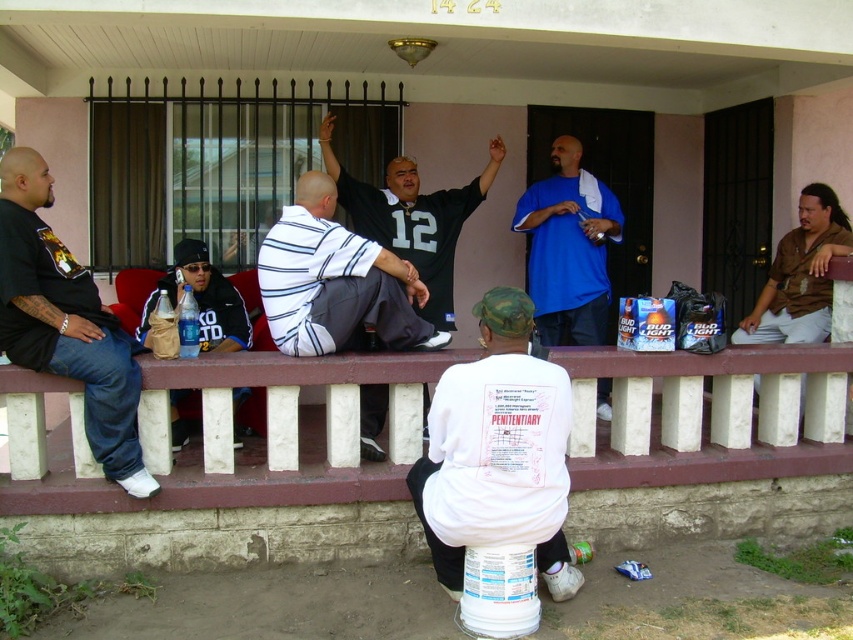
Question: Does white painted concrete at lower center appear over black jersey at center?

Choices:
 (A) yes
 (B) no

Answer: (B)

Question: Is white striped shirt at center wider than blue cotton shirt at center?

Choices:
 (A) no
 (B) yes

Answer: (B)

Question: Which of these objects is positioned closest to the matte black jacket at left?

Choices:
 (A) blue cotton shirt at center
 (B) white painted concrete at lower center

Answer: (B)

Question: Which point appears farthest from the camera in this image?

Choices:
 (A) (97, 349)
 (B) (387, 172)
 (C) (834, 241)
 (D) (28, 483)

Answer: (B)

Question: Which object is the closest to the dark blue jeans at left?

Choices:
 (A) white matte t-shirt at center
 (B) matte black jacket at left
 (C) blue cotton shirt at center
 (D) white painted concrete at lower center

Answer: (D)

Question: Is blue cotton shirt at center thinner than matte black jacket at left?

Choices:
 (A) yes
 (B) no

Answer: (B)